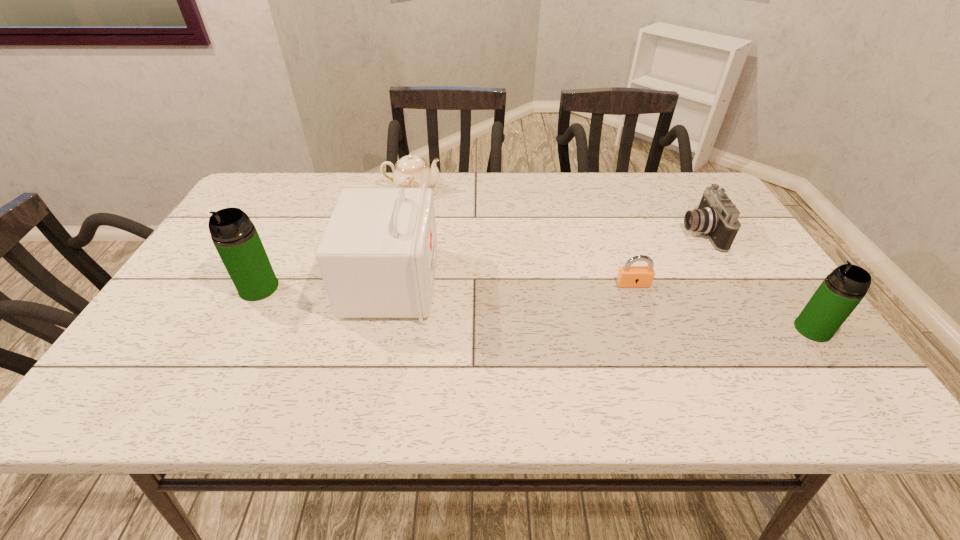
Identify the location of free spot located from the spout of the right thermos bottle. Image resolution: width=960 pixels, height=540 pixels. (706, 329).

I want to click on vacant region located from the spout of the right thermos bottle, so click(630, 329).

In order to click on free space located from the spout of the right thermos bottle in this screenshot , I will do `click(638, 329)`.

The height and width of the screenshot is (540, 960). In order to click on free region located at the spout of the chinaware in this screenshot , I will do `click(536, 190)`.

I want to click on free space located on the front-facing side of the first-aid kit, so click(561, 283).

Locate an element on the screen. free spot located to unlock the shortest object from the front is located at coordinates (652, 336).

This screenshot has height=540, width=960. I want to click on vacant area situated on the front-facing side of the fifth object from left to right, so click(547, 232).

Image resolution: width=960 pixels, height=540 pixels. Identify the location of vacant space located on the front-facing side of the fifth object from left to right. (647, 232).

Where is `free region located on the front-facing side of the fifth object from left to right`? This screenshot has height=540, width=960. free region located on the front-facing side of the fifth object from left to right is located at coordinates (608, 232).

Image resolution: width=960 pixels, height=540 pixels. I want to click on chinaware located in the far edge section of the desktop, so click(411, 171).